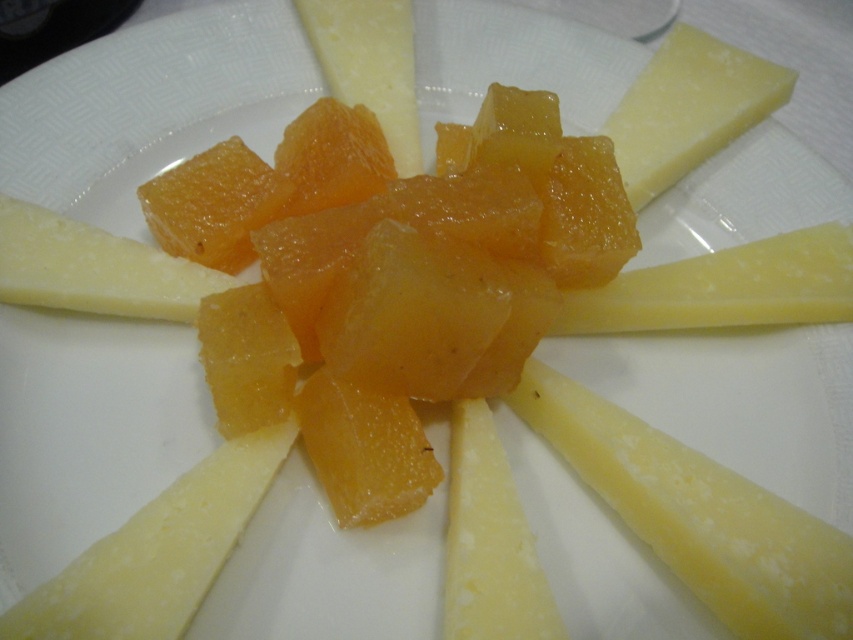
Question: Observing the image, what is the correct spatial positioning of yellow creamy cheese at lower right in reference to yellow/white hard cheese at center?

Choices:
 (A) above
 (B) below

Answer: (B)

Question: Does yellow creamy cheese at center have a greater width compared to yellow/semi-hard cheese at center?

Choices:
 (A) no
 (B) yes

Answer: (B)

Question: Estimate the real-world distances between objects in this image. Which object is closer to the yellow smooth cheese at lower right?

Choices:
 (A) yellow creamy cheese at center
 (B) yellow/white hard cheese at center

Answer: (A)

Question: Which point is farther from the camera taking this photo?

Choices:
 (A) (651, 170)
 (B) (840, 321)
 (C) (381, 26)
 (D) (460, 576)

Answer: (C)

Question: Can you confirm if yellow/white hard cheese at center is thinner than yellow/semi-hard cheese at center?

Choices:
 (A) yes
 (B) no

Answer: (B)

Question: Which is farther from the yellow creamy cheese at lower right?

Choices:
 (A) yellow creamy cheese at center
 (B) yellow smooth cheese at lower right
 (C) hard yellow cheese at upper right

Answer: (A)